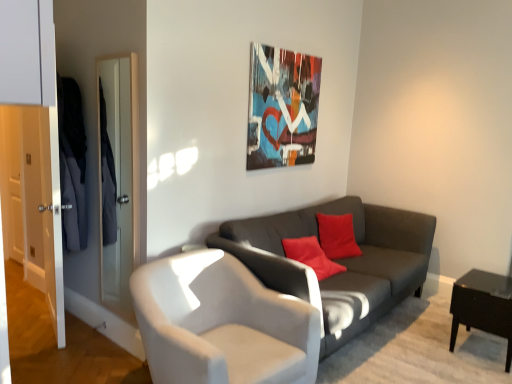
Question: Can you confirm if metallic abstract art at upper center is taller than white leather chair at center?

Choices:
 (A) yes
 (B) no

Answer: (A)

Question: From the image's perspective, is metallic abstract art at upper center on top of white leather chair at center?

Choices:
 (A) no
 (B) yes

Answer: (B)

Question: From a real-world perspective, is metallic abstract art at upper center physically above white leather chair at center?

Choices:
 (A) no
 (B) yes

Answer: (B)

Question: Are metallic abstract art at upper center and white leather chair at center far apart?

Choices:
 (A) yes
 (B) no

Answer: (A)

Question: Is metallic abstract art at upper center shorter than white leather chair at center?

Choices:
 (A) yes
 (B) no

Answer: (B)

Question: Considering the relative sizes of metallic abstract art at upper center and white leather chair at center in the image provided, is metallic abstract art at upper center thinner than white leather chair at center?

Choices:
 (A) no
 (B) yes

Answer: (B)

Question: Is black glossy side table at lower right bigger than white leather chair at center?

Choices:
 (A) no
 (B) yes

Answer: (A)

Question: Considering the relative sizes of black glossy side table at lower right and white leather chair at center in the image provided, is black glossy side table at lower right wider than white leather chair at center?

Choices:
 (A) no
 (B) yes

Answer: (A)

Question: From a real-world perspective, is black glossy side table at lower right located higher than white leather chair at center?

Choices:
 (A) no
 (B) yes

Answer: (A)

Question: Is black glossy side table at lower right shorter than white leather chair at center?

Choices:
 (A) no
 (B) yes

Answer: (B)

Question: Does black glossy side table at lower right lie behind white leather chair at center?

Choices:
 (A) no
 (B) yes

Answer: (B)

Question: Is black glossy side table at lower right thinner than white leather chair at center?

Choices:
 (A) no
 (B) yes

Answer: (B)

Question: Is metallic abstract art at upper center bigger than black glossy side table at lower right?

Choices:
 (A) yes
 (B) no

Answer: (B)